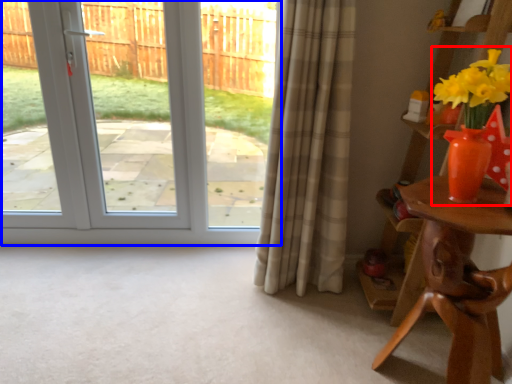
Question: Which object appears farthest to the camera in this image, floral arrangement (highlighted by a red box) or door (highlighted by a blue box)?

Choices:
 (A) floral arrangement
 (B) door

Answer: (B)